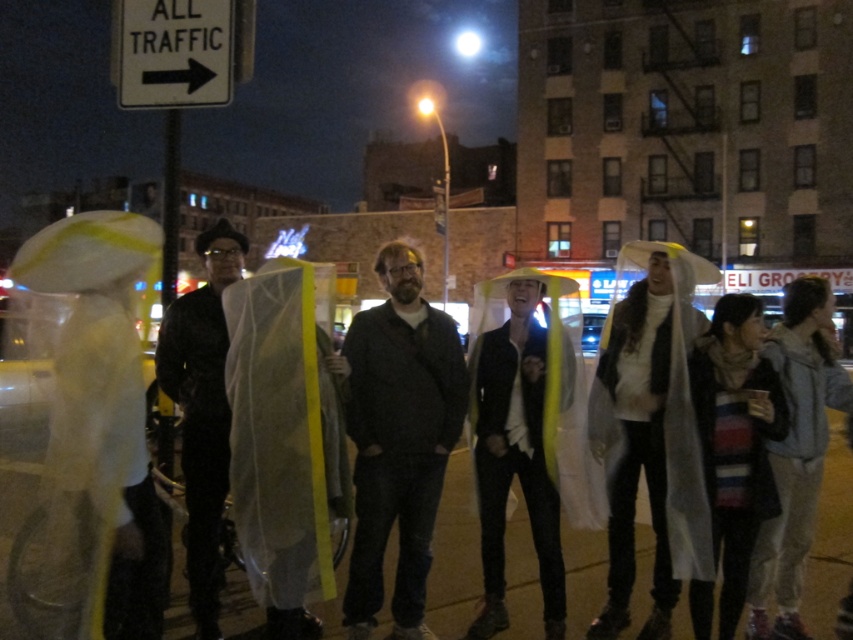
Is point (236, 243) in front of point (190, 100)?

Yes, it is.

You are a GUI agent. You are given a task and a screenshot of the screen. Output one action in this format:
    pyautogui.click(x=<x>, y=<y>)
    Task: Click on the black matte coat at center
    The image size is (853, 640).
    Given the screenshot: What is the action you would take?
    [x=202, y=412]

Is translucent yellow raincoat at center above black matte coat at center?

No, translucent yellow raincoat at center is not above black matte coat at center.

Is translucent yellow raincoat at center thinner than black matte coat at center?

Indeed, translucent yellow raincoat at center has a lesser width compared to black matte coat at center.

Is point (498, 401) in front of point (187, 448)?

No, (498, 401) is behind (187, 448).

Where is `translucent yellow raincoat at center`? This screenshot has height=640, width=853. translucent yellow raincoat at center is located at coordinates (520, 436).

Does translucent yellow raincoat at center come in front of white plastic sign at upper left?

Yes, translucent yellow raincoat at center is in front of white plastic sign at upper left.

Which is behind, point (548, 552) or point (155, 6)?

Point (155, 6)

The height and width of the screenshot is (640, 853). What do you see at coordinates (520, 436) in the screenshot?
I see `translucent yellow raincoat at center` at bounding box center [520, 436].

Where is `translucent yellow raincoat at center`? Image resolution: width=853 pixels, height=640 pixels. translucent yellow raincoat at center is located at coordinates (520, 436).